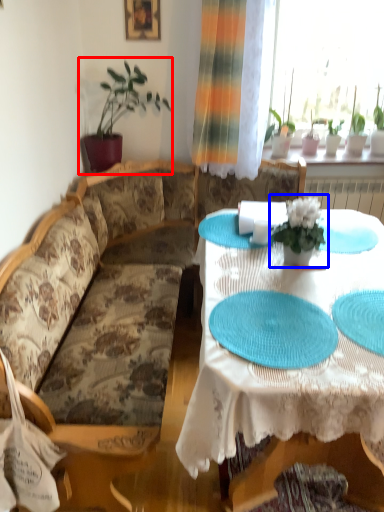
Question: Which point is further to the camera, houseplant (highlighted by a red box) or houseplant (highlighted by a blue box)?

Choices:
 (A) houseplant
 (B) houseplant

Answer: (A)